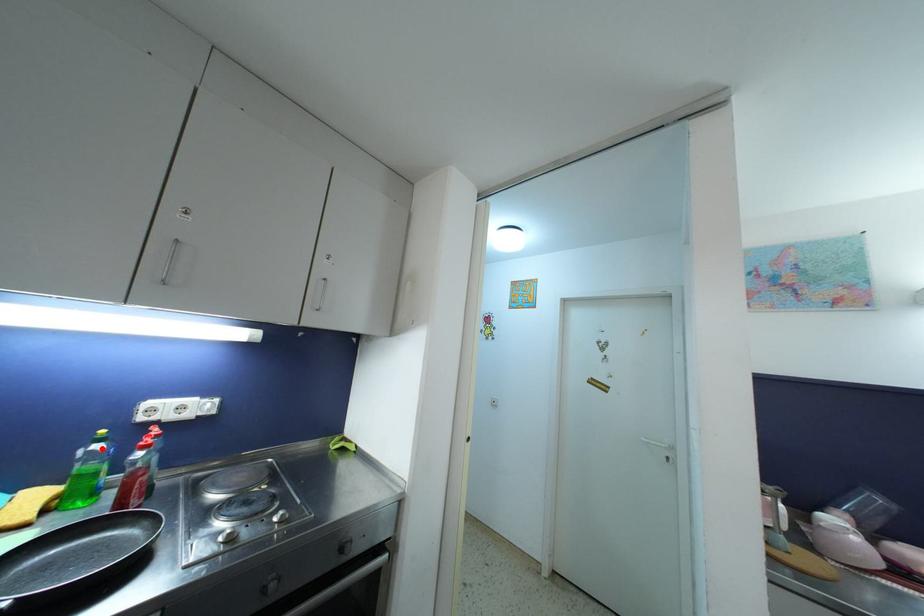
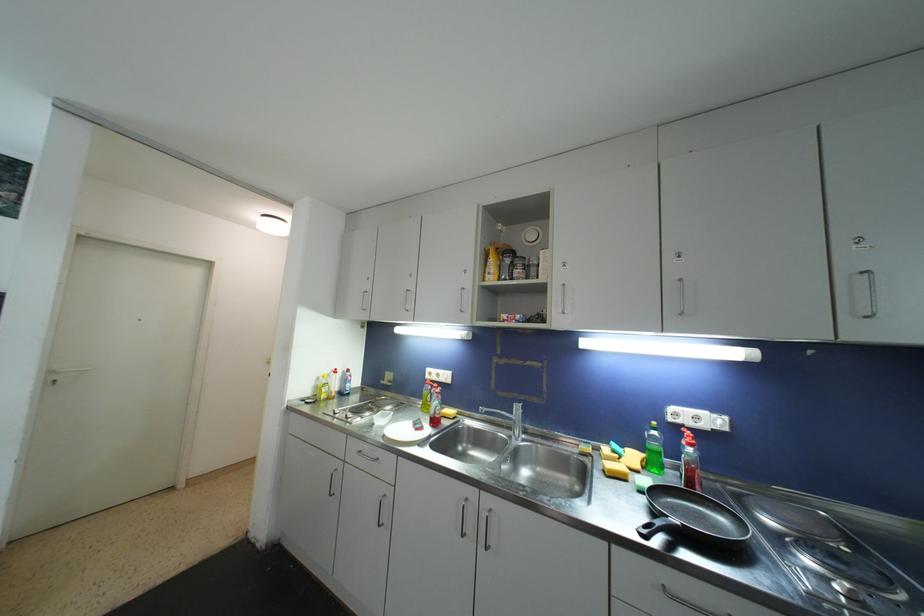
Question: I am providing you with two images of the same scene from different viewpoints. A red point is shown in image1. For the corresponding object point in image2, is it positioned nearer or farther from the camera?

Choices:
 (A) Nearer
 (B) Farther

Answer: (B)